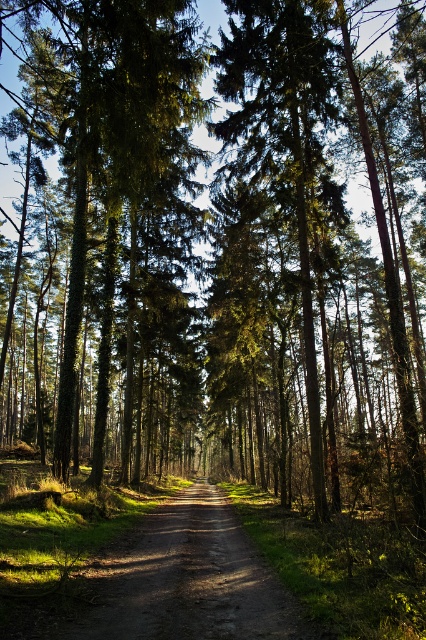
Question: Is green textured tree at center above dirt road at center?

Choices:
 (A) yes
 (B) no

Answer: (A)

Question: Can you confirm if green textured tree at center is positioned above dirt road at center?

Choices:
 (A) no
 (B) yes

Answer: (B)

Question: Which point is farther to the camera?

Choices:
 (A) green textured tree at center
 (B) dirt road at center

Answer: (A)

Question: Which point is farther from the camera taking this photo?

Choices:
 (A) (108, 54)
 (B) (218, 493)

Answer: (B)

Question: In this image, where is green textured tree at center located relative to dirt road at center?

Choices:
 (A) right
 (B) left

Answer: (B)